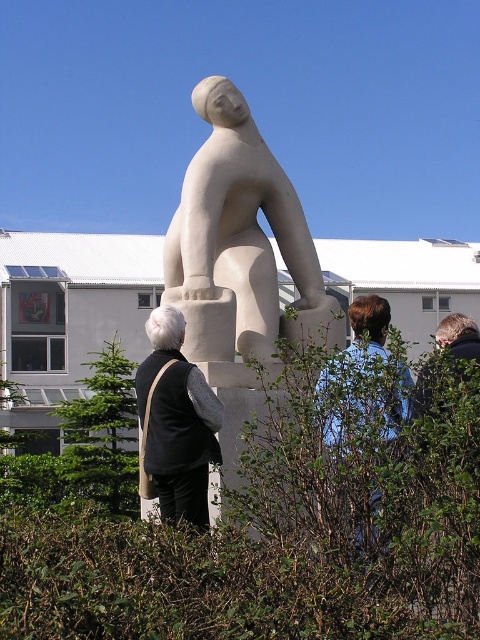
Question: Which of the following is the closest to the observer?

Choices:
 (A) green leafy bush at lower left
 (B) blue fabric shirt at center

Answer: (B)

Question: Does green leafy hedge at center come behind blue fabric shirt at center?

Choices:
 (A) yes
 (B) no

Answer: (B)

Question: Which of the following is the closest to the observer?

Choices:
 (A) blue fabric shirt at center
 (B) black fabric vest at center

Answer: (A)

Question: Considering the real-world distances, which object is farthest from the green leafy bush at lower left?

Choices:
 (A) black fabric vest at center
 (B) blue fabric shirt at center
 (C) green leafy hedge at center
 (D) white stone statue at center

Answer: (A)

Question: Can you confirm if green leafy hedge at center is positioned below green leafy bush at lower left?

Choices:
 (A) no
 (B) yes

Answer: (B)

Question: Does white stone statue at center have a lesser width compared to blue fabric shirt at center?

Choices:
 (A) no
 (B) yes

Answer: (A)